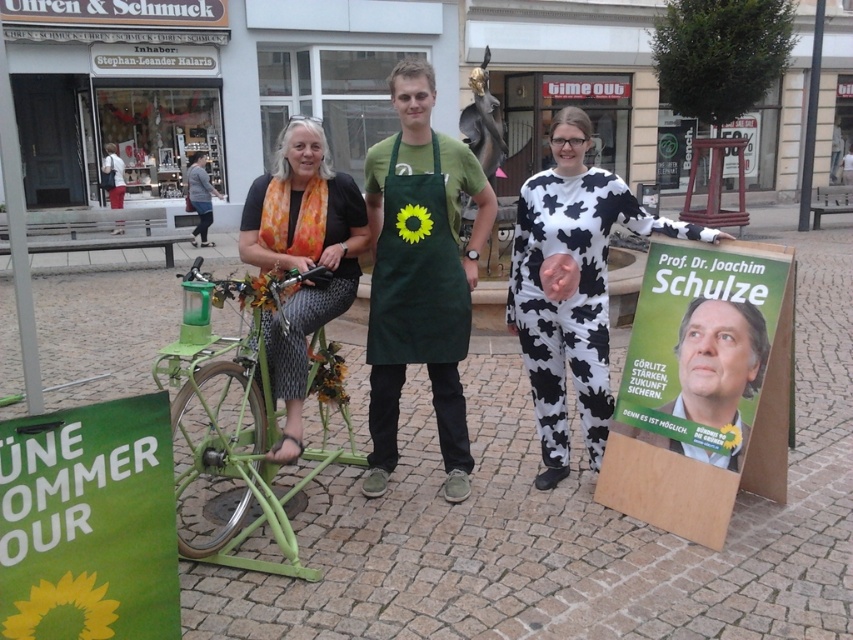
Between green paper poster at lower left and matte black shirt at center, which one appears on the right side from the viewer's perspective?

Positioned to the right is matte black shirt at center.

At what (x,y) coordinates should I click in order to perform the action: click on green paper poster at lower left. Please return your answer as a coordinate pair (x, y). The width and height of the screenshot is (853, 640). Looking at the image, I should click on (88, 524).

Does point (315, 195) come in front of point (387, 276)?

No, it is behind (387, 276).

Between matte black shirt at center and green canvas apron at center, which one is positioned higher?

green canvas apron at center is higher up.

At what (x,y) coordinates should I click in order to perform the action: click on matte black shirt at center. Please return your answer as a coordinate pair (x, y). Image resolution: width=853 pixels, height=640 pixels. Looking at the image, I should click on (302, 257).

Where is `matte black shirt at center`? matte black shirt at center is located at coordinates (302, 257).

Is green matte bicycle at center closer to camera compared to matte black shirt at center?

Yes, green matte bicycle at center is in front of matte black shirt at center.

Consider the image. Which of these two, green matte bicycle at center or matte black shirt at center, stands taller?

Standing taller between the two is matte black shirt at center.

Does point (250, 496) come behind point (325, 186)?

That is False.

You are a GUI agent. You are given a task and a screenshot of the screen. Output one action in this format:
    pyautogui.click(x=<x>, y=<y>)
    Task: Click on the green matte bicycle at center
    The image size is (853, 640).
    Given the screenshot: What is the action you would take?
    pyautogui.click(x=227, y=408)